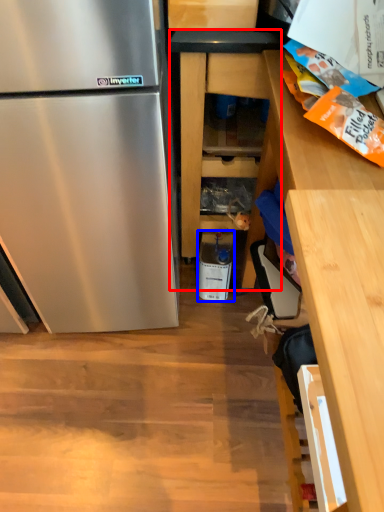
Question: Which of the following is the closest to the observer, cabinetry (highlighted by a red box) or appliance (highlighted by a blue box)?

Choices:
 (A) cabinetry
 (B) appliance

Answer: (A)